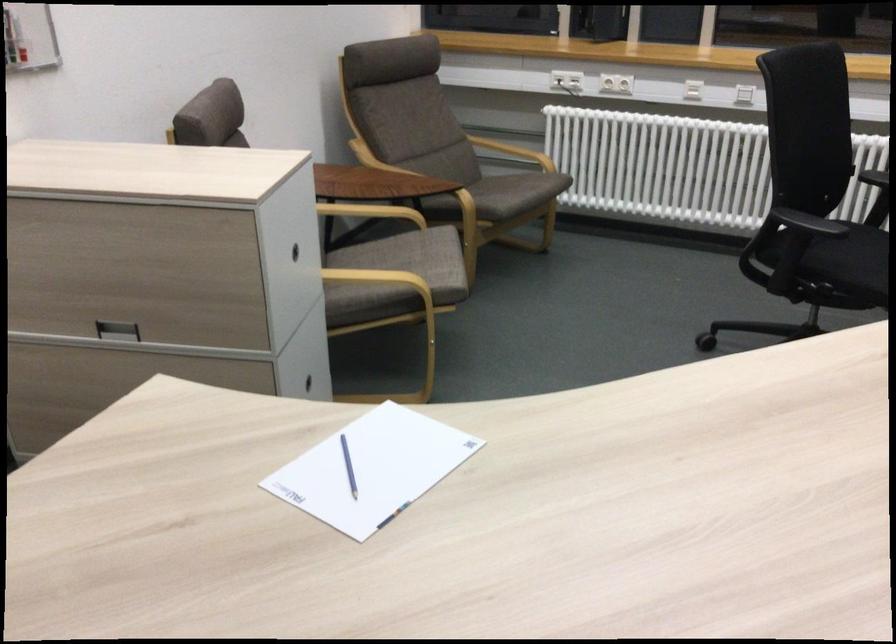
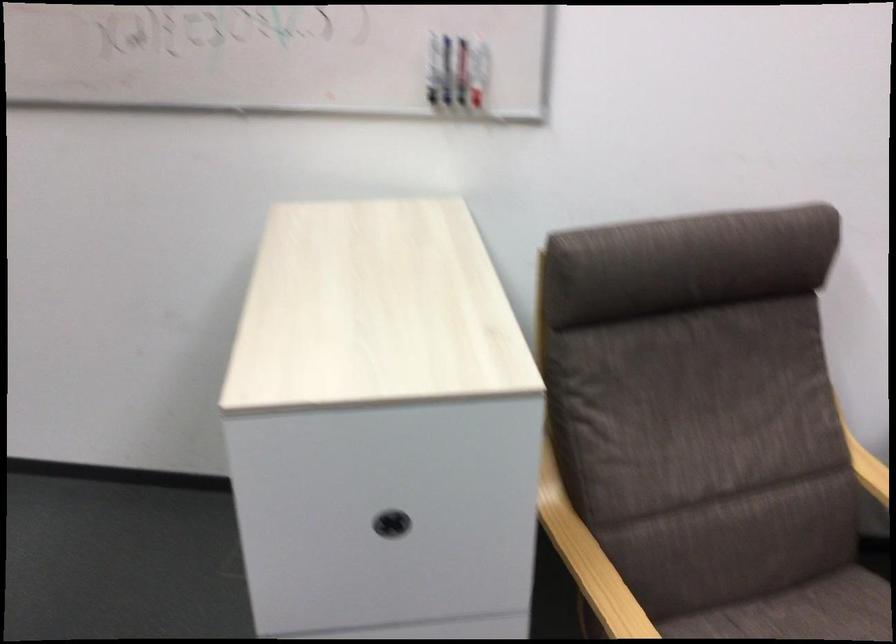
Question: I am providing you with two images of the same scene from different viewpoints. Please identify which objects are invisible in image2.

Choices:
 (A) black drawer handle
 (B) chair armrest
 (C) black skull mug
 (D) recessed drawer handle

Answer: (D)